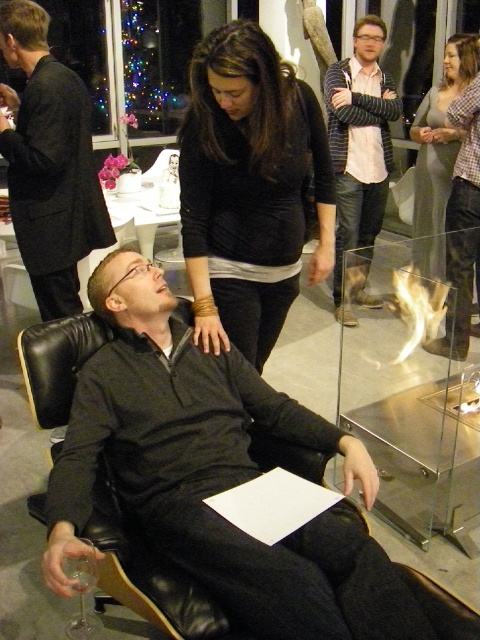
Question: Which point appears closest to the camera in this image?

Choices:
 (A) (311, 586)
 (B) (343, 362)
 (C) (194, 248)
 (D) (29, 56)

Answer: (A)

Question: Does black jersey at center have a greater width compared to transparent glass firebox at lower right?

Choices:
 (A) yes
 (B) no

Answer: (B)

Question: Estimate the real-world distances between objects in this image. Which object is closer to the gray sweater at upper right?

Choices:
 (A) clear glass wine glass at lower left
 (B) black jersey at center
 (C) striped sweater at center

Answer: (C)

Question: Which object is farther from the camera taking this photo?

Choices:
 (A) clear glass wine glass at lower left
 (B) gray sweater at upper right
 (C) matte black sweater at center

Answer: (B)

Question: Is the position of matte black sweater at center more distant than that of striped sweater at center?

Choices:
 (A) yes
 (B) no

Answer: (B)

Question: Can you confirm if matte black sweater at center is wider than black jersey at center?

Choices:
 (A) yes
 (B) no

Answer: (A)